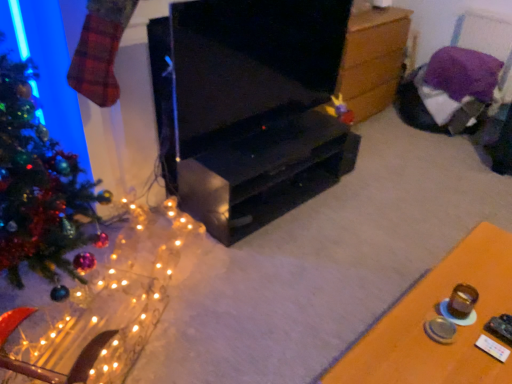
Question: Is shiny green christmas tree at left in front of or behind black matte tv cabinet at center in the image?

Choices:
 (A) behind
 (B) front

Answer: (B)

Question: From the image's perspective, is shiny green christmas tree at left positioned above or below black matte tv cabinet at center?

Choices:
 (A) above
 (B) below

Answer: (A)

Question: Which is farther from the black matte tv cabinet at center?

Choices:
 (A) purple fabric chair at upper right
 (B) shiny green christmas tree at left
 (C) wooden chest at center, acting as the 1th table starting from the back
 (D) black glossy tv stand at center
 (E) illuminated wire mesh at left

Answer: (A)

Question: Estimate the real-world distances between objects in this image. Which object is closer to the purple fabric chair at upper right?

Choices:
 (A) shiny green christmas tree at left
 (B) black matte tv cabinet at center
 (C) wooden table at lower right, the 2th table in the back-to-front sequence
 (D) illuminated wire mesh at left
 (E) wooden chest at center, acting as the 1th table starting from the back

Answer: (E)